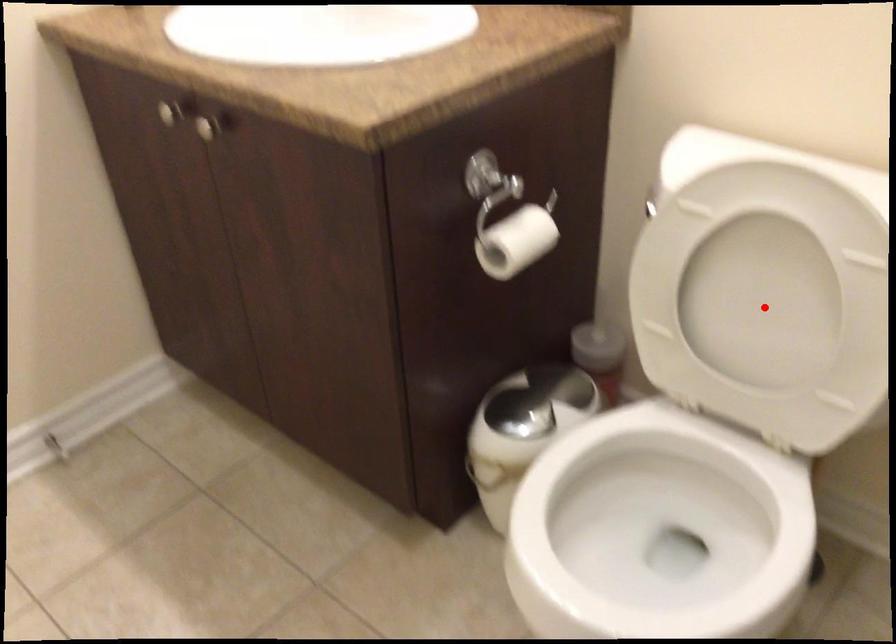
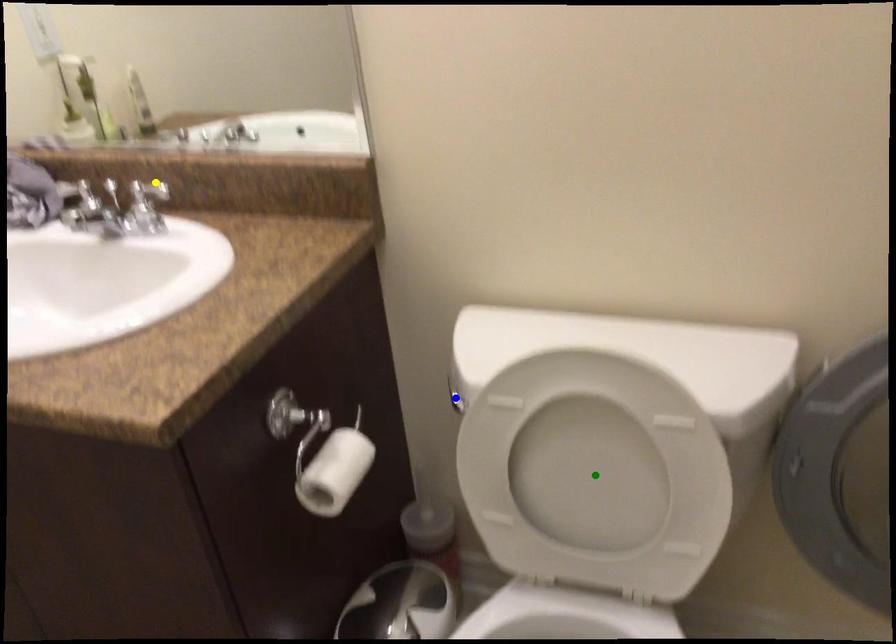
Question: I am providing you with two images of the same scene from different viewpoints. A red point is marked on the first image. You are given multiple points on the second image. Which spot in image 2 lines up with the point in image 1?

Choices:
 (A) yellow point
 (B) blue point
 (C) green point

Answer: (C)